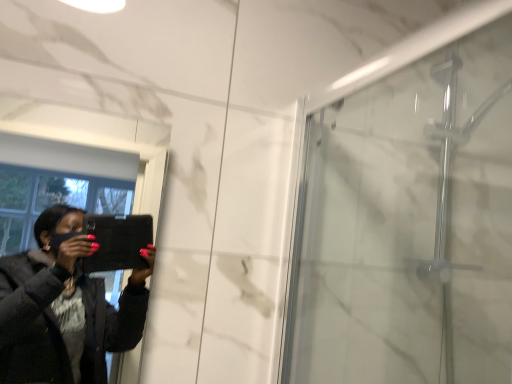
In order to click on matte black tablet at left in this screenshot , I will do `click(64, 308)`.

Describe the element at coordinates (64, 308) in the screenshot. I see `matte black tablet at left` at that location.

In order to face matte black tablet at left, should I rotate leftwards or rightwards?

Turn left by 22.780 degrees to look at matte black tablet at left.

This screenshot has width=512, height=384. I want to click on transparent glass shower door at right, so click(409, 226).

The width and height of the screenshot is (512, 384). Describe the element at coordinates (409, 226) in the screenshot. I see `transparent glass shower door at right` at that location.

Identify the location of matte black tablet at left. (64, 308).

Is matte black tablet at left to the left of transparent glass shower door at right from the viewer's perspective?

Indeed, matte black tablet at left is positioned on the left side of transparent glass shower door at right.

In the image, is matte black tablet at left positioned in front of or behind transparent glass shower door at right?

matte black tablet at left is in front of transparent glass shower door at right.

Is point (3, 268) closer to camera compared to point (317, 346)?

No, (3, 268) is behind (317, 346).

From the image's perspective, relative to transparent glass shower door at right, is matte black tablet at left above or below?

matte black tablet at left is below transparent glass shower door at right.

From a real-world perspective, is matte black tablet at left located higher than transparent glass shower door at right?

No, from a real-world perspective, matte black tablet at left is not above transparent glass shower door at right.

Which object is thinner, matte black tablet at left or transparent glass shower door at right?

With smaller width is matte black tablet at left.

Which of these two, matte black tablet at left or transparent glass shower door at right, stands taller?

transparent glass shower door at right is taller.

Considering the sizes of matte black tablet at left and transparent glass shower door at right in the image, is matte black tablet at left bigger or smaller than transparent glass shower door at right?

Considering their sizes, matte black tablet at left takes up less space than transparent glass shower door at right.

Looking at this image, is matte black tablet at left located outside transparent glass shower door at right?

Yes, matte black tablet at left is located beyond the bounds of transparent glass shower door at right.

Is matte black tablet at left far from transparent glass shower door at right?

No, matte black tablet at left is not far from transparent glass shower door at right.

Could you tell me if matte black tablet at left is facing transparent glass shower door at right?

No, matte black tablet at left does not turn towards transparent glass shower door at right.

Measure the distance between matte black tablet at left and transparent glass shower door at right.

matte black tablet at left is 38.87 inches from transparent glass shower door at right.

Locate an element on the screen. The width and height of the screenshot is (512, 384). screen door that appears above the matte black tablet at left (from a real-world perspective) is located at coordinates (409, 226).

Based on the photo, which is more to the right, transparent glass shower door at right or matte black tablet at left?

transparent glass shower door at right is more to the right.

Is transparent glass shower door at right behind matte black tablet at left?

Yes, transparent glass shower door at right is further from the viewer.

Which point is more forward, (x=430, y=256) or (x=23, y=279)?

The point (x=430, y=256) is closer to the camera.

In the scene shown: From the image's perspective, is transparent glass shower door at right above or below matte black tablet at left?

transparent glass shower door at right is above matte black tablet at left.

From a real-world perspective, which is physically above, transparent glass shower door at right or matte black tablet at left?

transparent glass shower door at right.

Which object is thinner, transparent glass shower door at right or matte black tablet at left?

Thinner between the two is matte black tablet at left.

Between transparent glass shower door at right and matte black tablet at left, which one has more height?

With more height is transparent glass shower door at right.

Between transparent glass shower door at right and matte black tablet at left, which one has larger size?

With larger size is transparent glass shower door at right.

Is transparent glass shower door at right inside or outside of matte black tablet at left?

transparent glass shower door at right is spatially situated outside matte black tablet at left.

Is the surface of transparent glass shower door at right in direct contact with matte black tablet at left?

No, transparent glass shower door at right is not with matte black tablet at left.

Is transparent glass shower door at right oriented away from matte black tablet at left?

No, transparent glass shower door at right is not facing the opposite direction of matte black tablet at left.

How different are the orientations of transparent glass shower door at right and matte black tablet at left in degrees?

There is a 0.154-degree angle between the facing directions of transparent glass shower door at right and matte black tablet at left.

Where is `screen door on the right of matte black tablet at left`? The height and width of the screenshot is (384, 512). screen door on the right of matte black tablet at left is located at coordinates (409, 226).

The image size is (512, 384). Find the location of `woman in front of the transparent glass shower door at right`. woman in front of the transparent glass shower door at right is located at coordinates (64, 308).

In order to click on screen door on the right of matte black tablet at left in this screenshot , I will do `click(409, 226)`.